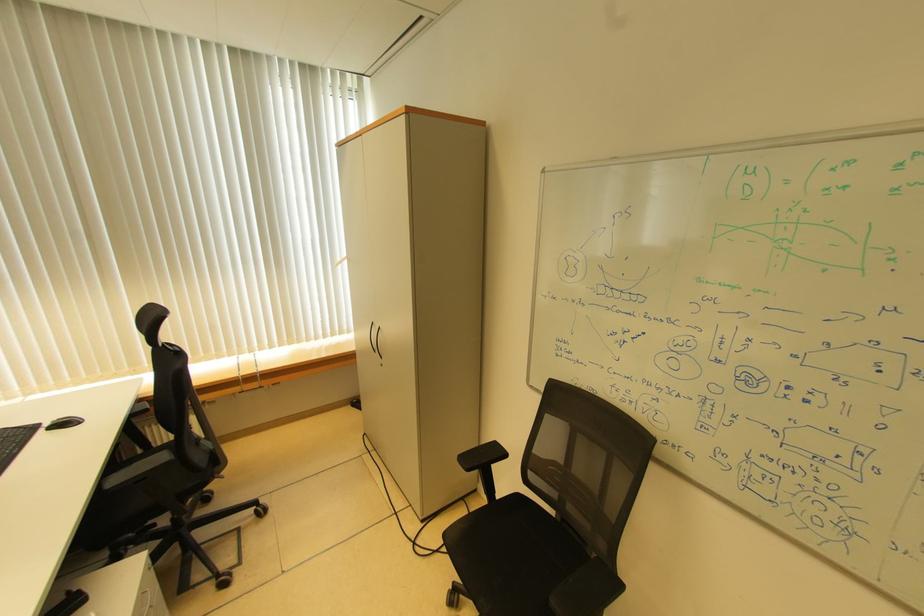
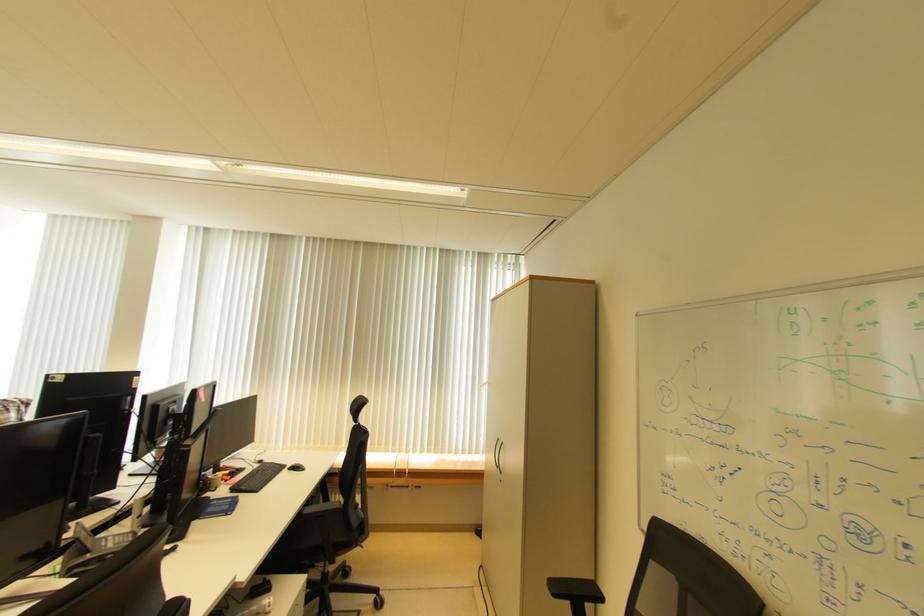
How did the camera likely rotate?

The camera rotated toward left-up.